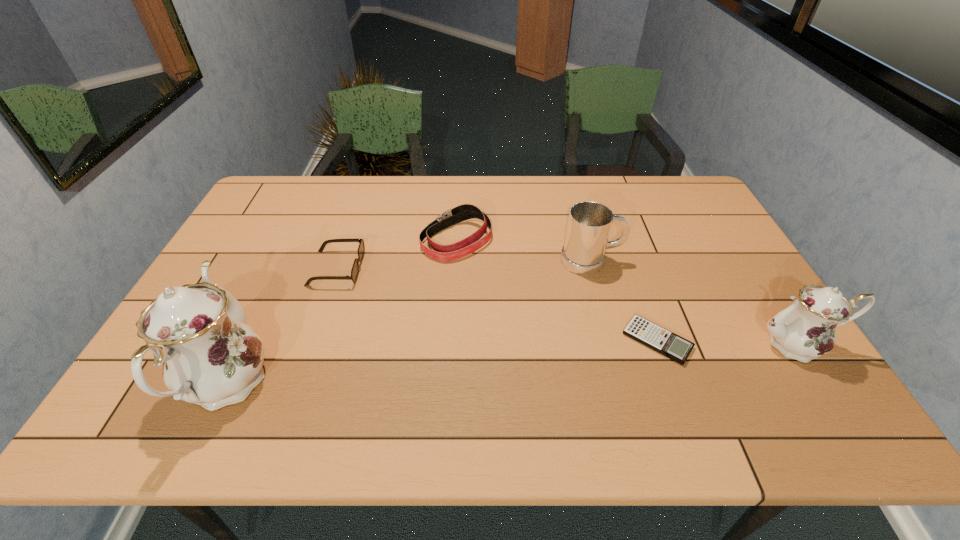
In order to click on free spot between the fifth tallest object and the third tallest object in this screenshot , I will do `click(464, 265)`.

Locate an element on the screen. free space between the tallest object and the right chinaware is located at coordinates (511, 363).

This screenshot has width=960, height=540. I want to click on vacant point located between the dog collar and the calculator, so click(557, 291).

Find the location of a particular element. The width and height of the screenshot is (960, 540). vacant area that lies between the fourth object from right to left and the right chinaware is located at coordinates (627, 292).

Where is `free space between the fifth tallest object and the fourth tallest object`? free space between the fifth tallest object and the fourth tallest object is located at coordinates (396, 254).

This screenshot has width=960, height=540. I want to click on free space between the taller chinaware and the fourth shortest object, so click(x=408, y=322).

Identify which object is located as the fourth nearest to the third object from left to right. Please provide its 2D coordinates. Your answer should be formatted as a tuple, i.e. [(x, y)], where the tuple contains the x and y coordinates of a point satisfying the conditions above.

[(211, 357)]

Find the location of a particular element. the second closest object to the shortest object is located at coordinates tap(589, 224).

The image size is (960, 540). I want to click on free location that satisfies the following two spatial constraints: 1. on the side of the third tallest object with the handle; 2. on the right side of the shortest object, so click(612, 341).

You are a GUI agent. You are given a task and a screenshot of the screen. Output one action in this format:
    pyautogui.click(x=<x>, y=<y>)
    Task: Click on the vacant area in the image that satisfies the following two spatial constraints: 1. on the back side of the shorter chinaware; 2. on the side of the mug with the handle
    This screenshot has height=540, width=960.
    Given the screenshot: What is the action you would take?
    743,261